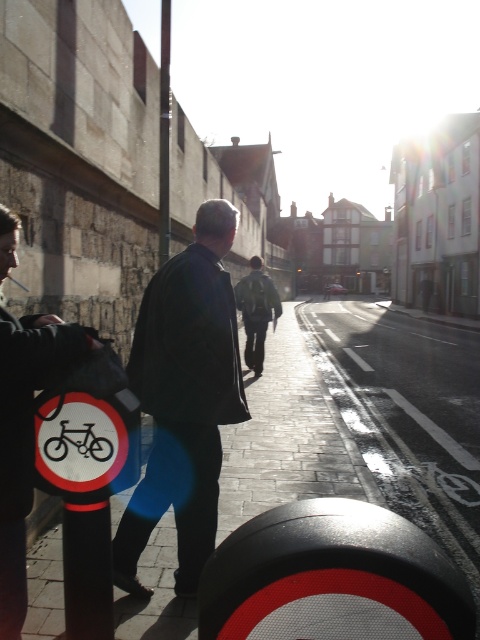
You are standing at the point closest to the camera in the image. Which of the two points, point (166, 4) or point (54, 449), is farther away from you?

Point (166, 4) is behind point (54, 449), so it is farther away from you.